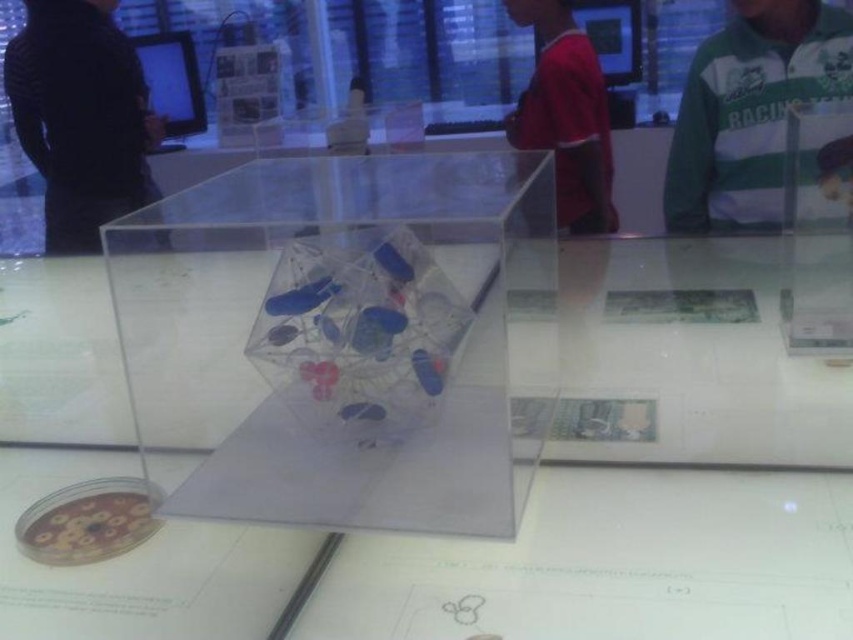
Does transparent acrylic cube at center appear over black matte jacket at left?

Actually, transparent acrylic cube at center is below black matte jacket at left.

Does transparent acrylic cube at center appear under black matte jacket at left?

Yes, transparent acrylic cube at center is below black matte jacket at left.

Find the location of a particular element. transparent acrylic cube at center is located at coordinates (345, 339).

Does green and white jersey at upper right have a larger size compared to red shirt at center?

Actually, green and white jersey at upper right might be smaller than red shirt at center.

Measure the distance between point (759, 88) and camera.

They are 6.09 feet apart.

The width and height of the screenshot is (853, 640). In order to click on green and white jersey at upper right in this screenshot , I will do (x=750, y=109).

Can you confirm if transparent plastic table at center is positioned above transparent acrylic cube at center?

Incorrect, transparent plastic table at center is not positioned above transparent acrylic cube at center.

Can you confirm if transparent plastic table at center is positioned below transparent acrylic cube at center?

Correct, transparent plastic table at center is located below transparent acrylic cube at center.

Between point (817, 362) and point (311, 257), which one is positioned behind?

The point (817, 362) is behind.

At what (x,y) coordinates should I click in order to perform the action: click on transparent plastic table at center. Please return your answer as a coordinate pair (x, y). Image resolution: width=853 pixels, height=640 pixels. Looking at the image, I should click on (647, 490).